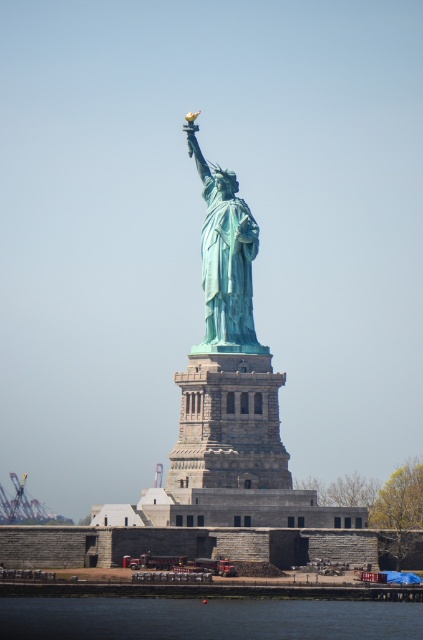
You are standing in front of the Statue of Liberty and want to take a photo. You notice two points on the statue labeled as point 1 and point 2. Point 1 is at coordinates point (285,621) and point 2 is at point (253,218). Which point is closer to you when you are facing the statue?

Point 1 is closer to the viewer than point 2.